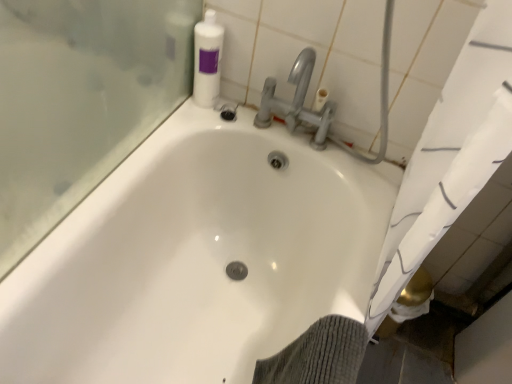
Where is `white plastic bottle at upper right`? The height and width of the screenshot is (384, 512). white plastic bottle at upper right is located at coordinates (207, 60).

What is the approximate width of white plastic bottle at upper right?

It is 3.55 inches.

The image size is (512, 384). What do you see at coordinates (207, 60) in the screenshot?
I see `white plastic bottle at upper right` at bounding box center [207, 60].

The image size is (512, 384). Describe the element at coordinates (196, 259) in the screenshot. I see `white glossy bathtub at center` at that location.

At what (x,y) coordinates should I click in order to perform the action: click on white glossy bathtub at center. Please return your answer as a coordinate pair (x, y). The height and width of the screenshot is (384, 512). Looking at the image, I should click on point(196,259).

Where is `white plastic bottle at upper right`? Image resolution: width=512 pixels, height=384 pixels. white plastic bottle at upper right is located at coordinates (207, 60).

Would you say white plastic bottle at upper right is to the left or to the right of white glossy bathtub at center in the picture?

white plastic bottle at upper right is positioned on white glossy bathtub at center's left side.

In the scene shown: Is white plastic bottle at upper right in front of or behind white glossy bathtub at center in the image?

Visually, white plastic bottle at upper right is located behind white glossy bathtub at center.

Which is in front, point (199, 57) or point (167, 361)?

The point (167, 361) is in front.

From the image's perspective, would you say white plastic bottle at upper right is positioned over white glossy bathtub at center?

Yes, from the image's perspective, white plastic bottle at upper right is above white glossy bathtub at center.

From a real-world perspective, is white plastic bottle at upper right physically located above or below white glossy bathtub at center?

white plastic bottle at upper right is above white glossy bathtub at center.

Considering the relative sizes of white plastic bottle at upper right and white glossy bathtub at center in the image provided, is white plastic bottle at upper right thinner than white glossy bathtub at center?

Correct, the width of white plastic bottle at upper right is less than that of white glossy bathtub at center.

Does white plastic bottle at upper right have a lesser height compared to white glossy bathtub at center?

Yes.

Does white plastic bottle at upper right have a larger size compared to white glossy bathtub at center?

Incorrect, white plastic bottle at upper right is not larger than white glossy bathtub at center.

Is white plastic bottle at upper right spatially inside white glossy bathtub at center, or outside of it?

white plastic bottle at upper right is outside white glossy bathtub at center.

Is white plastic bottle at upper right directly adjacent to white glossy bathtub at center?

white plastic bottle at upper right is not next to white glossy bathtub at center, and they're not touching.

Could you tell me if white plastic bottle at upper right is turned towards white glossy bathtub at center?

No, white plastic bottle at upper right is not facing towards white glossy bathtub at center.

What's the angular difference between white plastic bottle at upper right and white glossy bathtub at center's facing directions?

They differ by 85.5 degrees in their facing directions.

How far apart are white plastic bottle at upper right and white glossy bathtub at center?

white plastic bottle at upper right is 17.52 inches from white glossy bathtub at center.

At what (x,y) coordinates should I click in order to perform the action: click on bathtub below the white plastic bottle at upper right (from the image's perspective). Please return your answer as a coordinate pair (x, y). Looking at the image, I should click on (196, 259).

Consider the image. Considering the relative positions of white glossy bathtub at center and white plastic bottle at upper right in the image provided, is white glossy bathtub at center to the right of white plastic bottle at upper right from the viewer's perspective?

Yes, white glossy bathtub at center is to the right of white plastic bottle at upper right.

Which object is more forward, white glossy bathtub at center or white plastic bottle at upper right?

white glossy bathtub at center.

Between point (142, 177) and point (206, 33), which one is positioned behind?

The point (206, 33) is more distant.

From the image's perspective, who appears lower, white glossy bathtub at center or white plastic bottle at upper right?

white glossy bathtub at center appears lower in the image.

From a real-world perspective, who is located higher, white glossy bathtub at center or white plastic bottle at upper right?

white plastic bottle at upper right.

Does white glossy bathtub at center have a lesser width compared to white plastic bottle at upper right?

In fact, white glossy bathtub at center might be wider than white plastic bottle at upper right.

Does white glossy bathtub at center have a greater height compared to white plastic bottle at upper right?

Indeed, white glossy bathtub at center has a greater height compared to white plastic bottle at upper right.

Considering the sizes of white glossy bathtub at center and white plastic bottle at upper right in the image, is white glossy bathtub at center bigger or smaller than white plastic bottle at upper right?

white glossy bathtub at center is bigger than white plastic bottle at upper right.

Looking at this image, do you think white glossy bathtub at center is within white plastic bottle at upper right, or outside of it?

white glossy bathtub at center is located beyond the bounds of white plastic bottle at upper right.

Is white glossy bathtub at center directly adjacent to white plastic bottle at upper right?

white glossy bathtub at center is not next to white plastic bottle at upper right, and they're not touching.

Is white glossy bathtub at center facing away from white plastic bottle at upper right?

No, white glossy bathtub at center is not facing the opposite direction of white plastic bottle at upper right.

Identify the location of bathtub below the white plastic bottle at upper right (from the image's perspective). The width and height of the screenshot is (512, 384). (196, 259).

This screenshot has height=384, width=512. In order to click on cleaning product behind the white glossy bathtub at center in this screenshot , I will do `click(207, 60)`.

Identify the location of bathtub located on the right of white plastic bottle at upper right. The width and height of the screenshot is (512, 384). (196, 259).